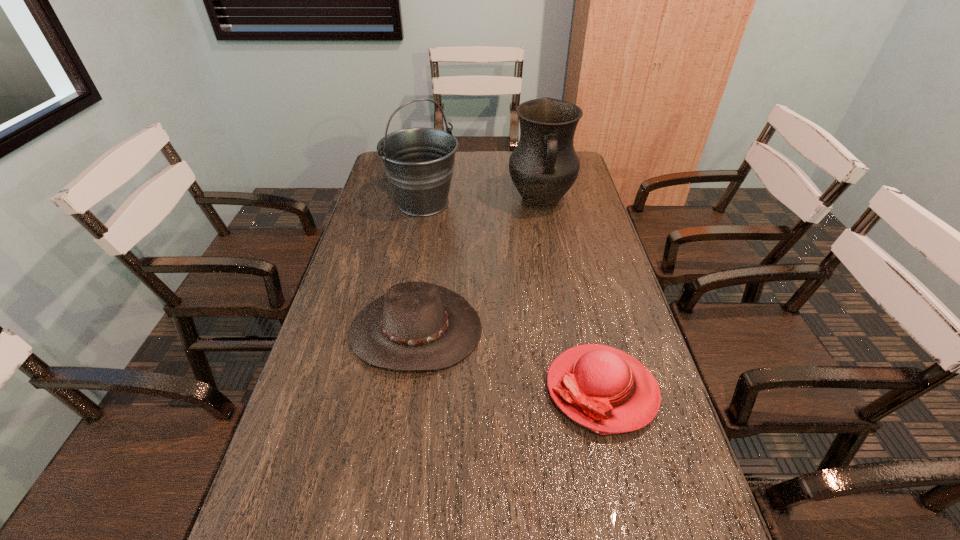
The image size is (960, 540). Identify the location of vacant space that's between the pitcher and the bucket. (482, 202).

Locate an element on the screen. Image resolution: width=960 pixels, height=540 pixels. blank region between the taller hat and the shortest object is located at coordinates (509, 360).

Locate an element on the screen. The width and height of the screenshot is (960, 540). empty space that is in between the shortest object and the bucket is located at coordinates (513, 296).

Where is `vacant area that lies between the third tallest object and the pitcher`? This screenshot has height=540, width=960. vacant area that lies between the third tallest object and the pitcher is located at coordinates (478, 266).

You are a GUI agent. You are given a task and a screenshot of the screen. Output one action in this format:
    pyautogui.click(x=<x>, y=<y>)
    Task: Click on the free space that is in between the pitcher and the taller hat
    Image resolution: width=960 pixels, height=540 pixels.
    Given the screenshot: What is the action you would take?
    pyautogui.click(x=478, y=266)

This screenshot has height=540, width=960. In order to click on vacant area between the third tallest object and the shortest object in this screenshot , I will do `click(509, 360)`.

Find the location of a particular element. This screenshot has width=960, height=540. empty location between the pitcher and the shortest object is located at coordinates (571, 296).

Locate an element on the screen. the second closest object to the pitcher is located at coordinates (415, 326).

Locate an element on the screen. object identified as the third closest to the shortest object is located at coordinates (419, 162).